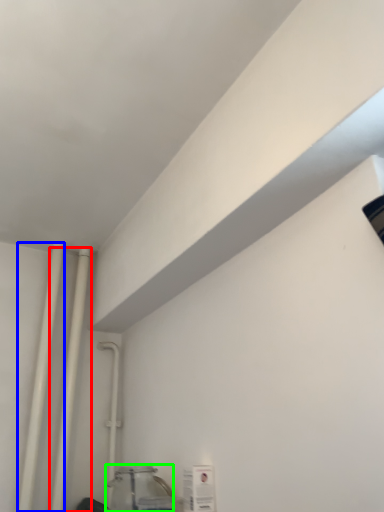
Question: Which object is the farthest from pipe (highlighted by a red box)? Choose among these: pipe (highlighted by a blue box) or glass jar (highlighted by a green box).

Choices:
 (A) pipe
 (B) glass jar

Answer: (B)